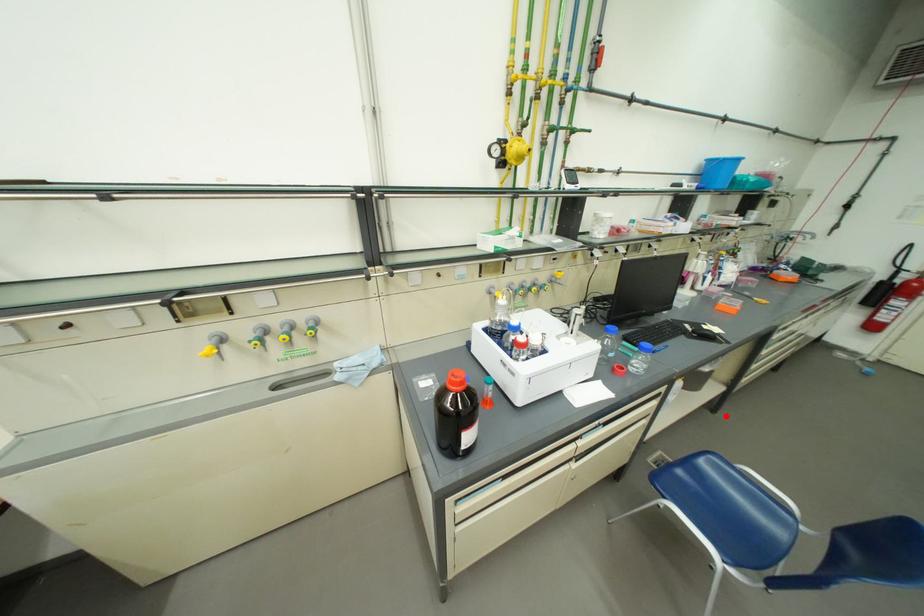
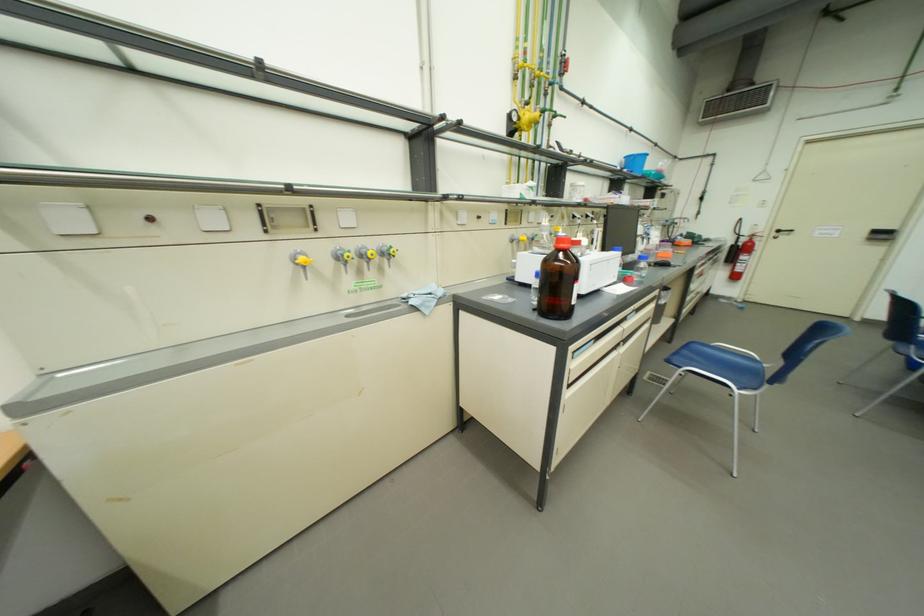
Question: I am providing you with two images of the same scene from different viewpoints. A red point is shown in image1. For the corresponding object point in image2, is it positioned nearer or farther from the camera?

Choices:
 (A) Nearer
 (B) Farther

Answer: (B)